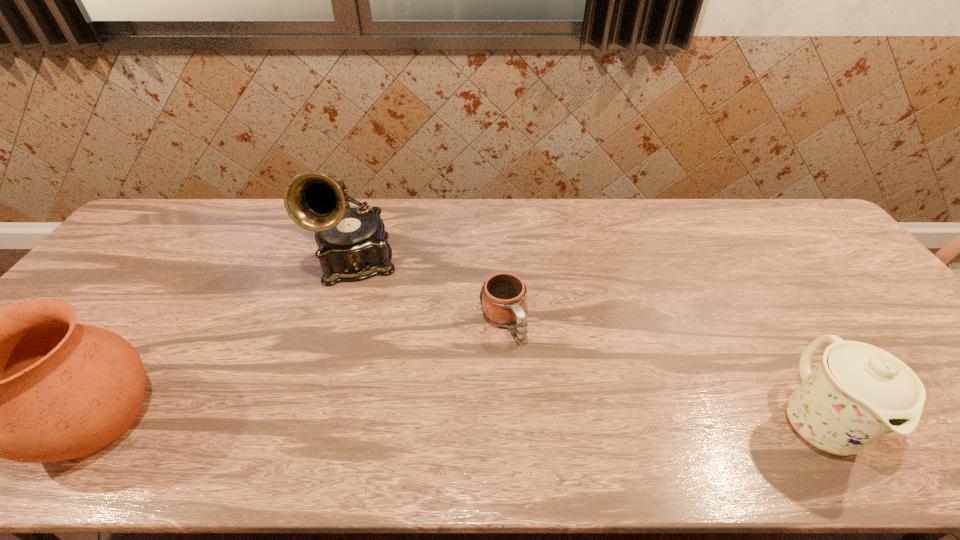
The image size is (960, 540). Identify the location of free space on the desktop that is between the pottery and the rightmost object and is positioned on the side of the shortest object with the handle. (558, 421).

Identify the location of vacant space on the desktop that is between the pottery and the second shortest object and is positioned on the horn of the third object from right to left. This screenshot has height=540, width=960. (373, 420).